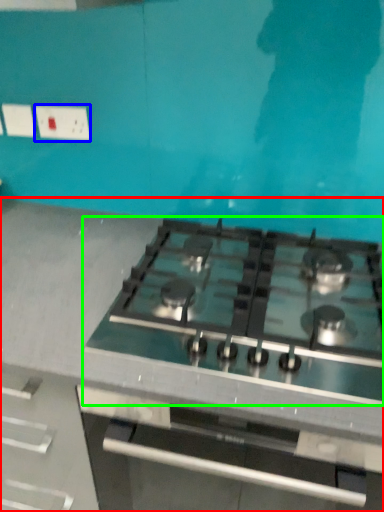
Question: Which is farther away from countertop (highlighted by a red box)? electric outlet (highlighted by a blue box) or gas stove (highlighted by a green box)?

Choices:
 (A) electric outlet
 (B) gas stove

Answer: (A)